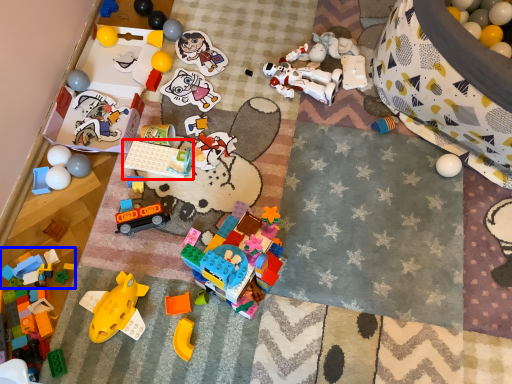
Question: Which object appears farthest to the camera in this image, toy (highlighted by a red box) or toy (highlighted by a blue box)?

Choices:
 (A) toy
 (B) toy

Answer: (A)